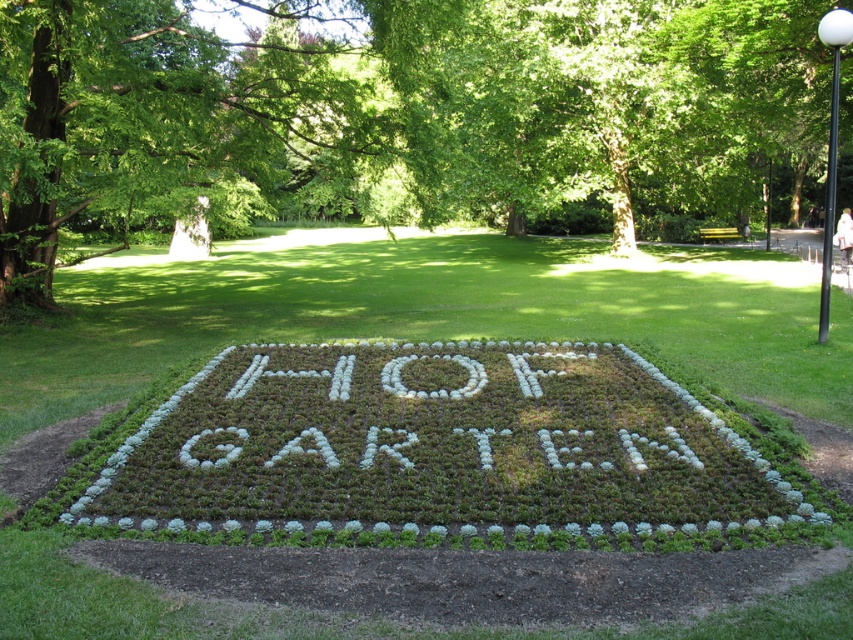
Does green leafy tree at upper left appear on the left side of black metal pole at upper right?

Indeed, green leafy tree at upper left is positioned on the left side of black metal pole at upper right.

Between green leafy tree at upper left and black metal pole at upper right, which one appears on the left side from the viewer's perspective?

green leafy tree at upper left

Between point (329, 141) and point (822, 20), which one is positioned in front?

Point (822, 20)

Locate an element on the screen. green leafy tree at upper left is located at coordinates (161, 120).

Which is behind, point (619, 144) or point (91, 621)?

The point (619, 144) is more distant.

Does green leafy tree at center have a greater height compared to green grass at center?

Yes.

Is point (524, 45) positioned in front of point (477, 292)?

No.

Locate an element on the screen. The height and width of the screenshot is (640, 853). green leafy tree at center is located at coordinates (x=402, y=118).

Which is above, green grass at center or green leafy tree at upper left?

green leafy tree at upper left

How far apart are green grass at center and green leafy tree at upper left?

They are 5.00 meters apart.

Which is behind, point (102, 305) or point (26, 4)?

The point (102, 305) is more distant.

The height and width of the screenshot is (640, 853). Identify the location of green grass at center. (426, 310).